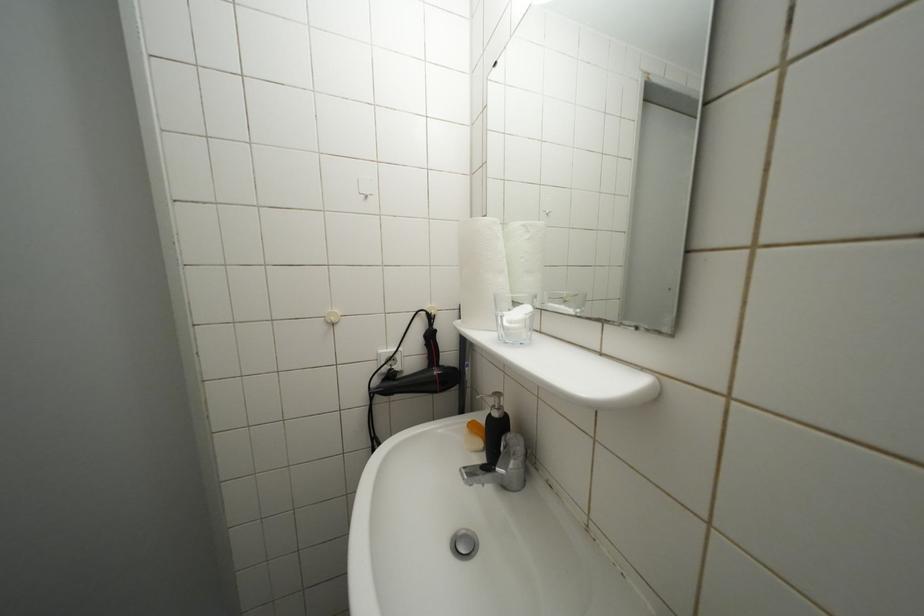
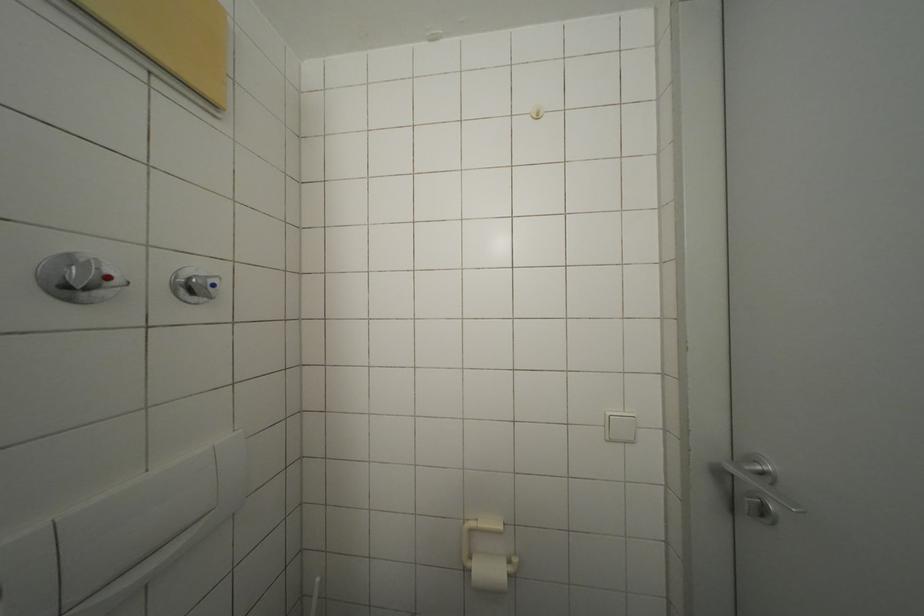
Question: Based on the continuous images, in which direction is the camera rotating? Reply with the corresponding letter.

Choices:
 (A) Left
 (B) Right
 (C) Up
 (D) Down

Answer: (A)